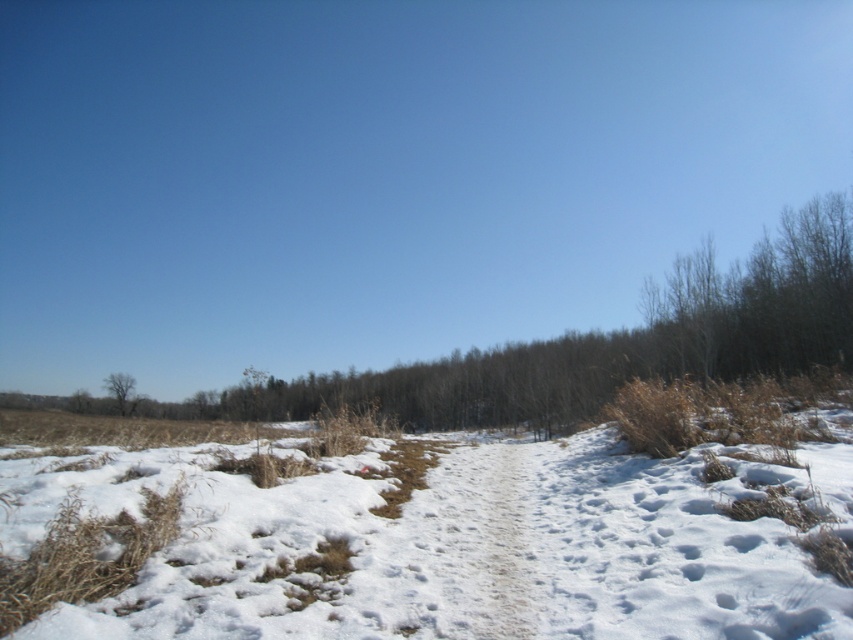
Who is more forward, (552,560) or (119,410)?

Positioned in front is point (552,560).

Does point (497, 454) lie in front of point (126, 385)?

Yes, point (497, 454) is in front of point (126, 385).

Does point (300, 566) come farther from viewer compared to point (132, 388)?

That is False.

At what (x,y) coordinates should I click in order to perform the action: click on white fluffy snow at center. Please return your answer as a coordinate pair (x, y). The image size is (853, 640). Looking at the image, I should click on (454, 545).